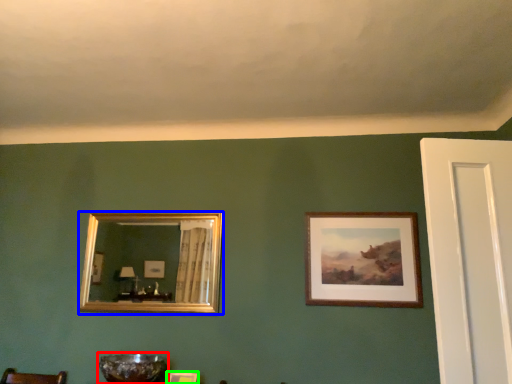
Question: Which object is positioned closest to glass bowl (highlighted by a red box)? Select from picture frame (highlighted by a blue box) and picture frame (highlighted by a green box).

Choices:
 (A) picture frame
 (B) picture frame

Answer: (B)